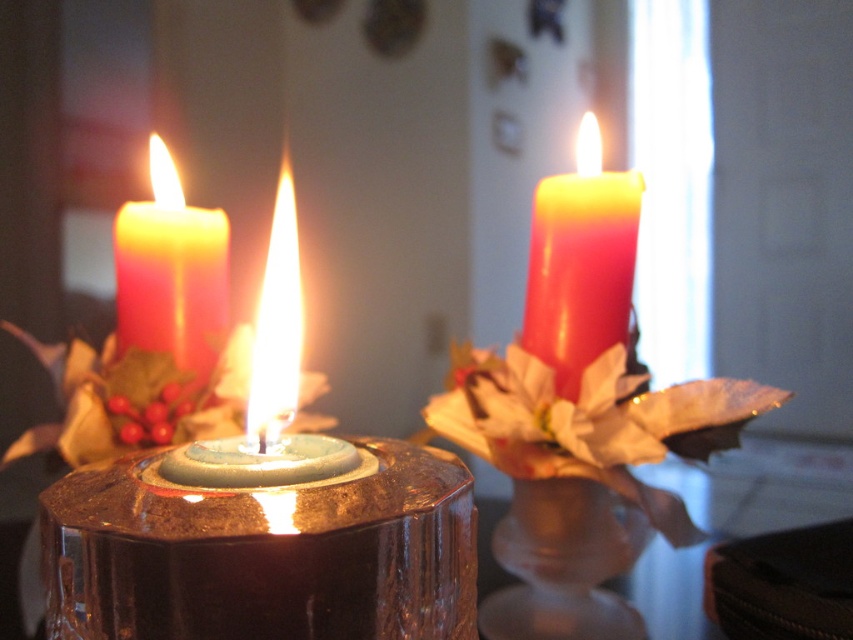
Is point (416, 451) positioned after point (165, 284)?

No, (416, 451) is in front of (165, 284).

Locate an element on the screen. The image size is (853, 640). glossy glass candle holder at center is located at coordinates (264, 518).

Measure the distance between matte red candle at right and camera.

matte red candle at right and camera are 17.12 inches apart from each other.

Is matte red candle at right wider than matte red candle at left?

No, matte red candle at right is not wider than matte red candle at left.

Is point (555, 346) positioned before point (206, 273)?

Yes, point (555, 346) is in front of point (206, 273).

This screenshot has height=640, width=853. Find the location of `matte red candle at right`. matte red candle at right is located at coordinates (579, 262).

Between point (289, 563) and point (601, 349), which one is positioned behind?

The point (601, 349) is more distant.

Consider the image. Can you confirm if glossy glass candle holder at center is bigger than matte red candle at right?

Indeed, glossy glass candle holder at center has a larger size compared to matte red candle at right.

Who is more forward, (372, 568) or (627, 268)?

Point (372, 568) is more forward.

The height and width of the screenshot is (640, 853). I want to click on glossy glass candle holder at center, so click(264, 518).